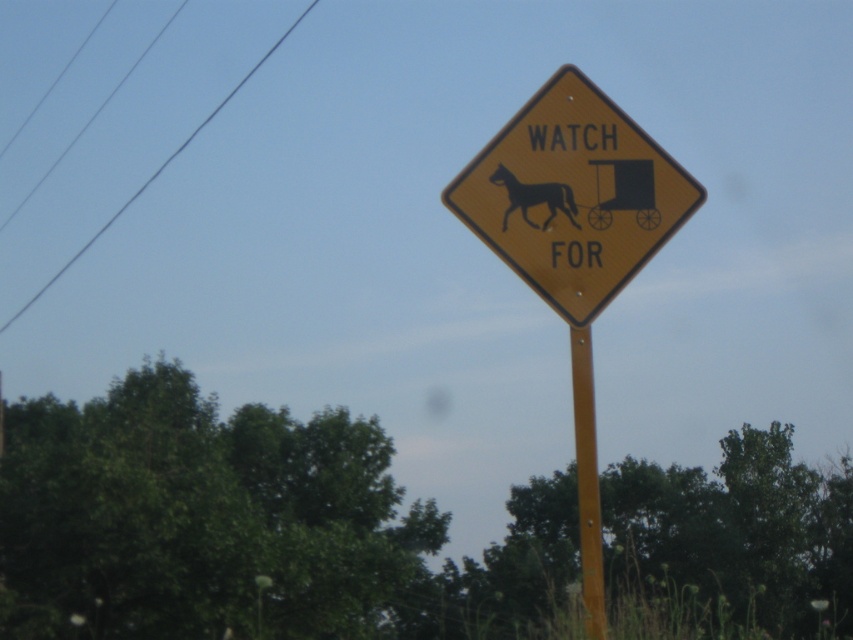
Is yellow diamond-shaped sign at center to the left of black wire at upper left from the viewer's perspective?

Incorrect, yellow diamond-shaped sign at center is not on the left side of black wire at upper left.

Is point (532, 164) positioned behind point (192, 131)?

No, (532, 164) is in front of (192, 131).

I want to click on yellow diamond-shaped sign at center, so click(572, 195).

From the picture: Is yellow matte sign at center above yellow diamond-shaped sign at center?

Indeed, yellow matte sign at center is positioned over yellow diamond-shaped sign at center.

Find the location of a particular element. yellow matte sign at center is located at coordinates (578, 241).

This screenshot has height=640, width=853. Identify the location of yellow metallic pole at center. (587, 483).

Is the position of yellow metallic pole at center less distant than that of black glossy horse at center?

That is True.

Is point (598, 580) farther from camera compared to point (509, 184)?

That is False.

Identify the location of yellow metallic pole at center. The height and width of the screenshot is (640, 853). (587, 483).